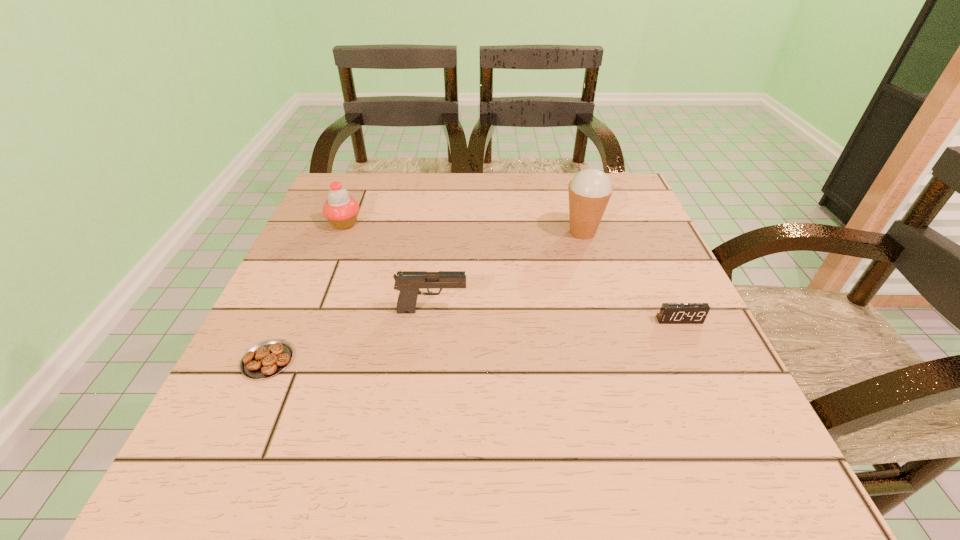
Find the location of a particular element. vacant area that lies between the cupcake and the fourth farthest object is located at coordinates (512, 272).

You are a GUI agent. You are given a task and a screenshot of the screen. Output one action in this format:
    pyautogui.click(x=<x>, y=<y>)
    Task: Click on the vacant space that's between the tallest object and the third object from right to left
    
    Given the screenshot: What is the action you would take?
    pyautogui.click(x=508, y=271)

Find the location of `free space between the fourth object from left to right and the rightmost object`. free space between the fourth object from left to right and the rightmost object is located at coordinates (631, 276).

At what (x,y) coordinates should I click in order to perform the action: click on empty location between the third nearest object and the cupcake. Please return your answer as a coordinate pair (x, y). This screenshot has height=540, width=960. Looking at the image, I should click on (389, 267).

Where is `free spot between the cupcake and the shortest object`? The image size is (960, 540). free spot between the cupcake and the shortest object is located at coordinates (306, 292).

Where is `vacant area that lies between the third farthest object and the cupcake`? The height and width of the screenshot is (540, 960). vacant area that lies between the third farthest object and the cupcake is located at coordinates click(x=389, y=267).

Locate an element on the screen. The width and height of the screenshot is (960, 540). free space between the cupcake and the second shortest object is located at coordinates (512, 272).

Where is `the third closest object to the rightmost object`? the third closest object to the rightmost object is located at coordinates [268, 358].

Identify which object is located as the fourth nearest to the pastry. Please provide its 2D coordinates. Your answer should be formatted as a tuple, i.e. [(x, y)], where the tuple contains the x and y coordinates of a point satisfying the conditions above.

[(670, 313)]